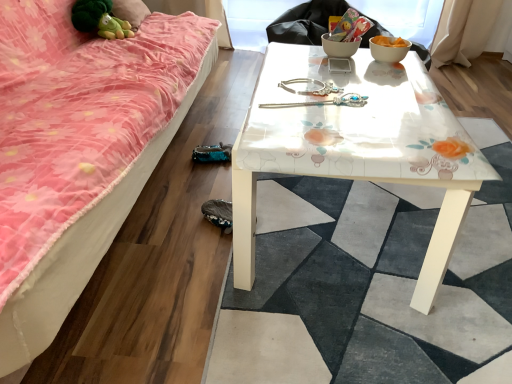
In order to click on green plush toy at upper left in this screenshot , I will do `click(100, 20)`.

Identify the location of pink fabric studio couch at lower left. (84, 248).

You are a GUI agent. You are given a task and a screenshot of the screen. Output one action in this format:
    pyautogui.click(x=<x>, y=<y>)
    Task: Click on the green plush toy at upper left
    
    Given the screenshot: What is the action you would take?
    pyautogui.click(x=100, y=20)

From the picture: Is white glossy table at center facing away from silver metallic hairpin at center?

white glossy table at center does not have its back to silver metallic hairpin at center.

From a real-world perspective, is white glossy table at center above or below silver metallic hairpin at center?

white glossy table at center is below silver metallic hairpin at center.

Considering the sizes of objects white glossy table at center and silver metallic hairpin at center in the image provided, who is bigger, white glossy table at center or silver metallic hairpin at center?

white glossy table at center.

From a real-world perspective, between white glossy table at center and white glossy bowl at upper right, who is vertically higher?

From a 3D spatial view, white glossy bowl at upper right is above.

Can we say white glossy table at center lies outside white glossy bowl at upper right?

white glossy table at center lies outside white glossy bowl at upper right's area.

Which of these two, white glossy table at center or white glossy bowl at upper right, is thinner?

Thinner between the two is white glossy bowl at upper right.

Is white glossy table at center at the right side of white glossy bowl at upper right?

No, white glossy table at center is not to the right of white glossy bowl at upper right.

Is pink fabric studio couch at lower left surrounded by white glossy bowl at upper right?

No, pink fabric studio couch at lower left is not surrounded by white glossy bowl at upper right.

Can you confirm if white glossy bowl at upper right is taller than pink fabric studio couch at lower left?

In fact, white glossy bowl at upper right may be shorter than pink fabric studio couch at lower left.

Considering the sizes of white glossy bowl at upper right and pink fabric studio couch at lower left in the image, is white glossy bowl at upper right bigger or smaller than pink fabric studio couch at lower left?

white glossy bowl at upper right is smaller than pink fabric studio couch at lower left.

Does point (372, 51) appear closer or farther from the camera than point (106, 214)?

Point (372, 51) appears to be farther away from the viewer than point (106, 214).

This screenshot has width=512, height=384. In order to click on bowl on the right side of silver metallic hairpin at center in this screenshot , I will do `click(388, 49)`.

From a real-world perspective, which is physically above, silver metallic hairpin at center or white glossy bowl at upper right?

From a 3D spatial view, white glossy bowl at upper right is above.

From their relative heights in the image, would you say silver metallic hairpin at center is taller or shorter than white glossy bowl at upper right?

Clearly, silver metallic hairpin at center is shorter compared to white glossy bowl at upper right.

Looking at the image, does silver metallic hairpin at center seem bigger or smaller compared to white glossy bowl at upper right?

Considering their sizes, silver metallic hairpin at center takes up less space than white glossy bowl at upper right.

Which is more to the left, white glossy table at center or green plush toy at upper left?

green plush toy at upper left is more to the left.

Is white glossy table at center positioned before green plush toy at upper left?

Yes, it is in front of green plush toy at upper left.

From the image's perspective, is white glossy table at center under green plush toy at upper left?

Yes.

Is white glossy table at center smaller than green plush toy at upper left?

No.

Can you confirm if silver metallic hairpin at center is wider than white glossy table at center?

Incorrect, the width of silver metallic hairpin at center does not surpass that of white glossy table at center.

The height and width of the screenshot is (384, 512). What are the coordinates of `twin on the left of white glossy table at center` in the screenshot? It's located at (324, 102).

From the image's perspective, is silver metallic hairpin at center located above or below white glossy table at center?

silver metallic hairpin at center is situated higher than white glossy table at center in the image.

Is silver metallic hairpin at center located outside white glossy table at center?

That's incorrect, silver metallic hairpin at center is not completely outside white glossy table at center.

Could silver metallic hairpin at center be considered to be inside white glossy bowl at upper right?

Actually, silver metallic hairpin at center is outside white glossy bowl at upper right.

Is white glossy bowl at upper right facing towards silver metallic hairpin at center?

No, white glossy bowl at upper right is not turned towards silver metallic hairpin at center.

From the image's perspective, which is above, white glossy bowl at upper right or silver metallic hairpin at center?

white glossy bowl at upper right is shown above in the image.

In terms of width, does white glossy bowl at upper right look wider or thinner when compared to silver metallic hairpin at center?

Clearly, white glossy bowl at upper right has more width compared to silver metallic hairpin at center.

Where is `table below the silver metallic hairpin at center (from a real-world perspective)`? Image resolution: width=512 pixels, height=384 pixels. table below the silver metallic hairpin at center (from a real-world perspective) is located at coordinates (356, 147).

Where is `table on the left of the white glossy bowl at upper right`? This screenshot has height=384, width=512. table on the left of the white glossy bowl at upper right is located at coordinates (356, 147).

Looking at this image, looking at the image, which one is located closer to pink fabric studio couch at lower left, green plush toy at upper left or white glossy bowl at upper right?

green plush toy at upper left is closer to pink fabric studio couch at lower left.

Looking at the image, which one is located closer to green plush toy at upper left, white glossy table at center or white glossy bowl at upper right?

Based on the image, white glossy table at center appears to be nearer to green plush toy at upper left.

When comparing their distances from green plush toy at upper left, does pink fabric studio couch at lower left or white glossy bowl at upper right seem further?

white glossy bowl at upper right is further to green plush toy at upper left.

Considering their positions, is pink fabric studio couch at lower left positioned closer to green plush toy at upper left than white glossy table at center?

Among the two, pink fabric studio couch at lower left is located nearer to green plush toy at upper left.

Looking at the image, which one is located closer to white glossy table at center, white glossy bowl at upper right or silver metallic hairpin at center?

silver metallic hairpin at center is positioned closer to the anchor white glossy table at center.

When comparing their distances from white glossy bowl at upper right, does pink fabric studio couch at lower left or green plush toy at upper left seem further?

green plush toy at upper left is further to white glossy bowl at upper right.

Considering their positions, is white glossy table at center positioned closer to pink fabric studio couch at lower left than silver metallic hairpin at center?

silver metallic hairpin at center is closer to pink fabric studio couch at lower left.

From the image, which object appears to be farther from white glossy bowl at upper right, silver metallic hairpin at center or green plush toy at upper left?

The object further to white glossy bowl at upper right is green plush toy at upper left.

Where is `table situated between pink fabric studio couch at lower left and white glossy bowl at upper right from left to right`? This screenshot has width=512, height=384. table situated between pink fabric studio couch at lower left and white glossy bowl at upper right from left to right is located at coordinates (356, 147).

Image resolution: width=512 pixels, height=384 pixels. Find the location of `twin between pink fabric studio couch at lower left and white glossy bowl at upper right in the horizontal direction`. twin between pink fabric studio couch at lower left and white glossy bowl at upper right in the horizontal direction is located at coordinates (324, 102).

The height and width of the screenshot is (384, 512). I want to click on twin located between white glossy table at center and white glossy bowl at upper right in the depth direction, so click(324, 102).

Locate an element on the screen. The height and width of the screenshot is (384, 512). bowl between pink fabric studio couch at lower left and green plush toy at upper left along the z-axis is located at coordinates (388, 49).